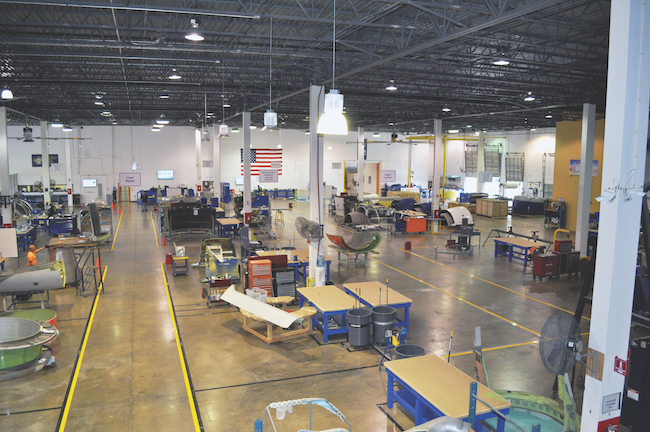
Locate an element on the screen. floor is located at coordinates (142, 299).